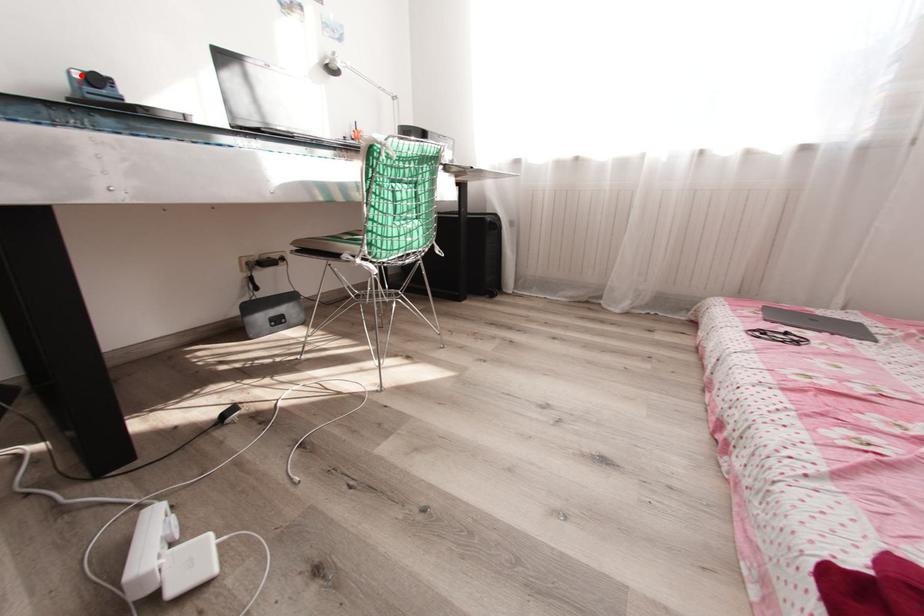
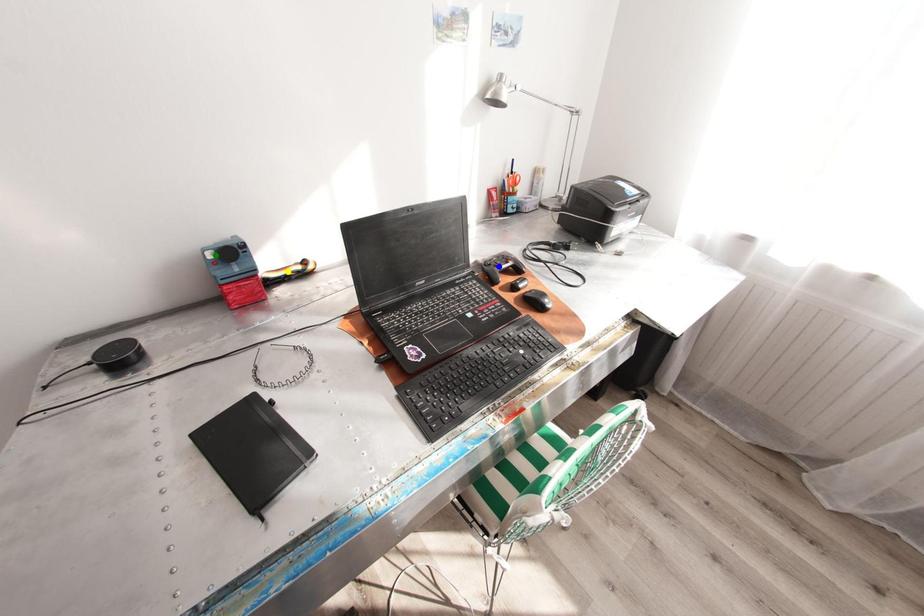
Question: I am providing you with two images of the same scene from different viewpoints. A red point is marked on the first image. You are given multiple points on the second image. In image 2, which mark is for the same physical point as the one in image 1?

Choices:
 (A) green point
 (B) yellow point
 (C) blue point

Answer: (A)